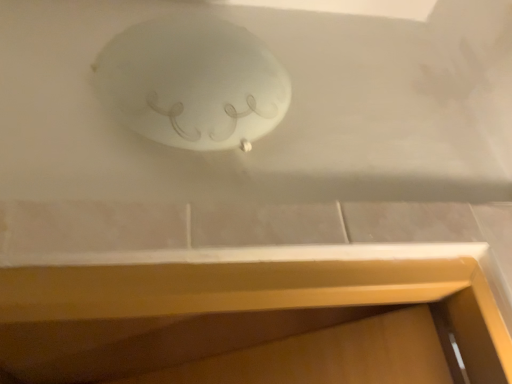
What are the coordinates of `frosted glass lampshade at upper center` in the screenshot? It's located at (193, 83).

What do you see at coordinates (193, 83) in the screenshot? I see `frosted glass lampshade at upper center` at bounding box center [193, 83].

Image resolution: width=512 pixels, height=384 pixels. In order to click on frosted glass lampshade at upper center in this screenshot , I will do `click(193, 83)`.